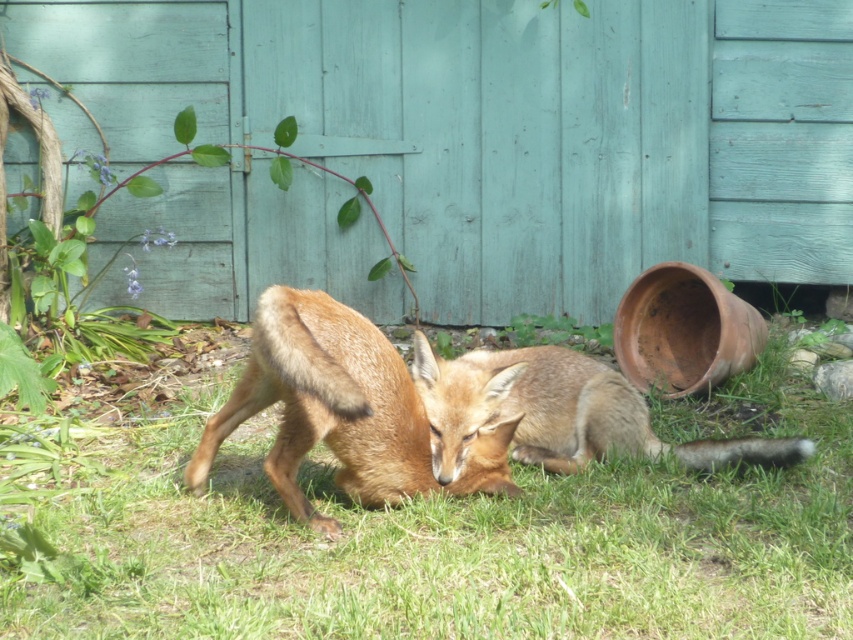
Is green grass at center further to camera compared to brown fur fox at center?

No, it is in front of brown fur fox at center.

Who is more forward, (105, 547) or (305, 346)?

Positioned in front is point (305, 346).

Find the location of a particular element. Image resolution: width=853 pixels, height=640 pixels. green grass at center is located at coordinates (459, 540).

Can you confirm if green grass at center is shorter than golden fur fox at center?

Incorrect, green grass at center's height does not fall short of golden fur fox at center's.

In the scene shown: Who is taller, green grass at center or golden fur fox at center?

With more height is green grass at center.

Image resolution: width=853 pixels, height=640 pixels. Describe the element at coordinates (459, 540) in the screenshot. I see `green grass at center` at that location.

Find the location of a particular element. green grass at center is located at coordinates (459, 540).

From the picture: Is brown fur fox at center shorter than golden fur fox at center?

In fact, brown fur fox at center may be taller than golden fur fox at center.

Between brown fur fox at center and golden fur fox at center, which one appears on the right side from the viewer's perspective?

From the viewer's perspective, golden fur fox at center appears more on the right side.

Identify the location of brown fur fox at center. This screenshot has width=853, height=640. (339, 410).